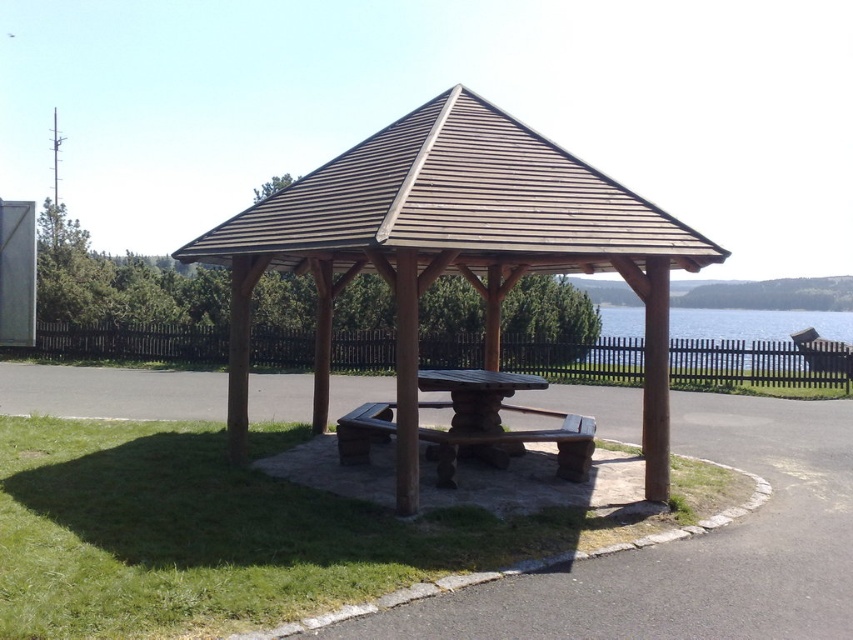
You are standing at the entrance of the gazebo and want to step onto the green grass at center. Based on the gazebo and surrounding layout, can you directly walk straight ahead without needing to move sideways?

The green grass at center is located at point (236, 534), which suggests it is positioned in front of the gazebo. Since the gazebo has an elevated structure with a table and benches in front of it, walking straight ahead from the entrance would likely lead towards the grass area without needing to move sideways.

You are planning to set up a picnic at the gazebo. You have a large blanket that is 2 meters by 2 meters. Considering the space taken by the green grass at center and the rustic wood bench at center, will there be enough room to spread out the blanket without overlapping either?

The green grass at center occupies less space than rustic wood bench at center. Since the blanket is 2 meters by 2 meters, it may not fit if the available space between or around these objects is smaller than the blanket size. However, the exact arrangement isn not specified, so it depends on the layout.

You are planning to set up a small picnic at the green grass at center. However, you notice the rustic wood table at center is nearby. Considering their heights, which one is taller?

The rustic wood table at center is taller than the green grass at center.